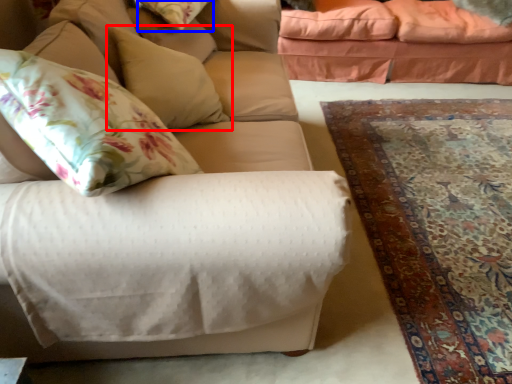
Question: Which point is closer to the camera, pillow (highlighted by a red box) or pillow (highlighted by a blue box)?

Choices:
 (A) pillow
 (B) pillow

Answer: (A)